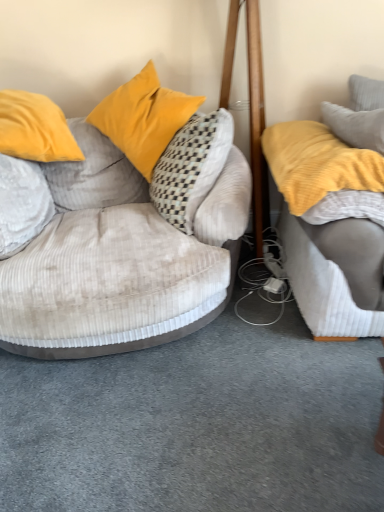
Question: Can we say gray textured pillow at upper right, the 1th pillow from the right, lies outside velvet beige studio couch at left, which is counted as the first studio couch, starting from the left?

Choices:
 (A) yes
 (B) no

Answer: (A)

Question: Is gray textured pillow at upper right, the 1th pillow from the right, thinner than velvet beige studio couch at left, which is counted as the first studio couch, starting from the left?

Choices:
 (A) no
 (B) yes

Answer: (B)

Question: Is gray textured pillow at upper right, the fourth pillow positioned from the left, with velvet beige studio couch at left, which is counted as the first studio couch, starting from the left?

Choices:
 (A) yes
 (B) no

Answer: (B)

Question: Is gray textured pillow at upper right, the fourth pillow positioned from the left, behind velvet beige studio couch at left, which is counted as the 2th studio couch, starting from the right?

Choices:
 (A) yes
 (B) no

Answer: (A)

Question: Is gray textured pillow at upper right, the fourth pillow positioned from the left, taller than velvet beige studio couch at left, which is counted as the first studio couch, starting from the left?

Choices:
 (A) no
 (B) yes

Answer: (A)

Question: Considering the positions of point (332, 280) and point (165, 142), is point (332, 280) closer or farther from the camera than point (165, 142)?

Choices:
 (A) farther
 (B) closer

Answer: (B)

Question: In terms of width, does yellow soft fabric studio couch at right, which appears as the 1th studio couch when viewed from the right, look wider or thinner when compared to velvet yellow pillow at upper left, which is counted as the second pillow, starting from the left?

Choices:
 (A) thin
 (B) wide

Answer: (B)

Question: In terms of size, does yellow soft fabric studio couch at right, which ranks as the second studio couch in left-to-right order, appear bigger or smaller than velvet yellow pillow at upper left, which is counted as the second pillow, starting from the left?

Choices:
 (A) big
 (B) small

Answer: (A)

Question: From a real-world perspective, is yellow soft fabric studio couch at right, which appears as the 1th studio couch when viewed from the right, positioned above or below velvet yellow pillow at upper left, which is the third pillow in right-to-left order?

Choices:
 (A) above
 (B) below

Answer: (B)

Question: From the image's perspective, is gray textured pillow at upper right, the 1th pillow from the right, positioned above or below velvet yellow pillow at upper left, which is the third pillow in right-to-left order?

Choices:
 (A) below
 (B) above

Answer: (B)

Question: Is gray textured pillow at upper right, the fourth pillow positioned from the left, in front of or behind velvet yellow pillow at upper left, which is the third pillow in right-to-left order, in the image?

Choices:
 (A) behind
 (B) front

Answer: (A)

Question: In the image, is gray textured pillow at upper right, the 1th pillow from the right, on the left side or the right side of velvet yellow pillow at upper left, which is the third pillow in right-to-left order?

Choices:
 (A) left
 (B) right

Answer: (B)

Question: Is gray textured pillow at upper right, the fourth pillow positioned from the left, wider or thinner than velvet yellow pillow at upper left, which is counted as the second pillow, starting from the left?

Choices:
 (A) thin
 (B) wide

Answer: (A)

Question: Is soft white pillow at left, the 1th pillow from the left, in front of or behind velvet yellow pillow at upper left, which is counted as the second pillow, starting from the left, in the image?

Choices:
 (A) behind
 (B) front

Answer: (B)

Question: In the image, is soft white pillow at left, the 1th pillow from the left, on the left side or the right side of velvet yellow pillow at upper left, which is the third pillow in right-to-left order?

Choices:
 (A) right
 (B) left

Answer: (B)